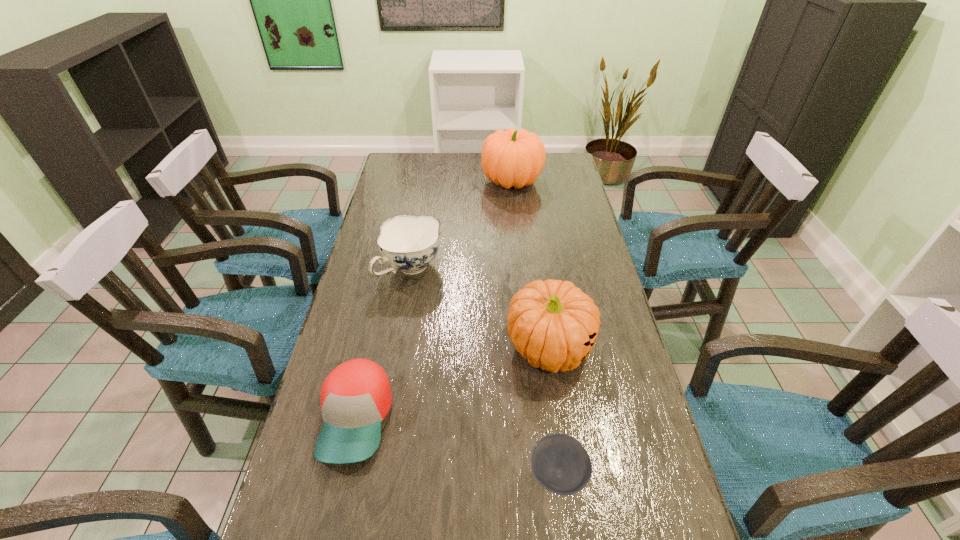
Where is `blank region between the shortest object and the nearer pumpkin`? blank region between the shortest object and the nearer pumpkin is located at coordinates (554, 411).

Locate an element on the screen. free spot between the second farthest object and the bowl is located at coordinates (485, 372).

The height and width of the screenshot is (540, 960). Identify the location of blank region between the baseball cap and the chinaware. (383, 343).

I want to click on vacant region between the fourth nearest object and the second shortest object, so point(383,343).

Where is `free space between the nearer pumpkin and the bowl`? The width and height of the screenshot is (960, 540). free space between the nearer pumpkin and the bowl is located at coordinates coord(554,411).

Find the location of a particular element. The height and width of the screenshot is (540, 960). vacant region between the second farthest object and the second shortest object is located at coordinates click(x=383, y=343).

Locate an element on the screen. free space that is in between the second farthest object and the farthest object is located at coordinates (462, 225).

Identify which object is located as the nearest to the shortest object. Please provide its 2D coordinates. Your answer should be formatted as a tuple, i.e. [(x, y)], where the tuple contains the x and y coordinates of a point satisfying the conditions above.

[(553, 324)]

Find the location of a particular element. object that stands as the second closest to the bowl is located at coordinates (355, 398).

Identify the location of vacant area in the image that satisfies the following two spatial constraints: 1. on the back side of the fourth nearest object; 2. on the left side of the farthest object. The width and height of the screenshot is (960, 540). (426, 181).